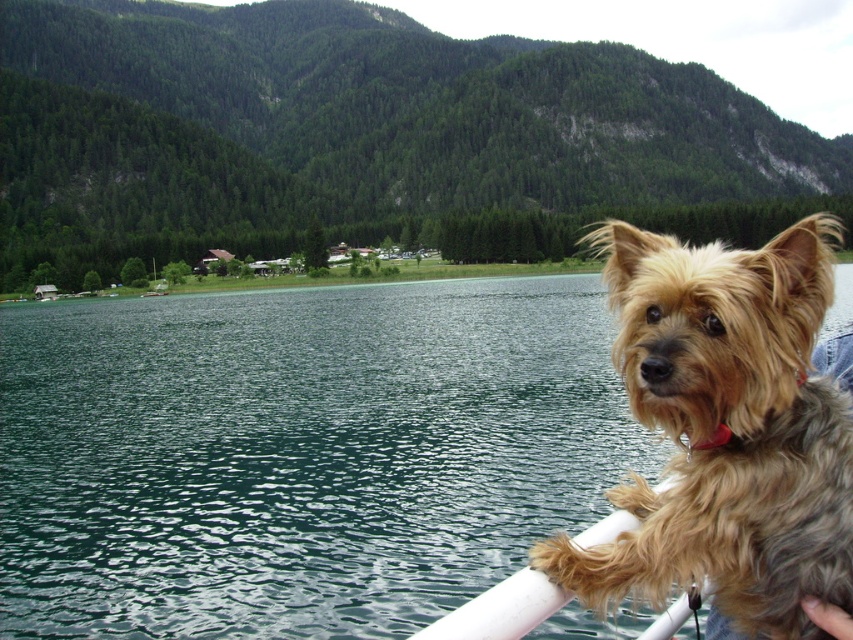
Which is more to the left, green water at lower left or golden fur dog at right?

green water at lower left is more to the left.

Is point (399, 492) positioned after point (703, 253)?

Yes, point (399, 492) is farther from viewer.

Locate an element on the screen. Image resolution: width=853 pixels, height=640 pixels. green water at lower left is located at coordinates (299, 452).